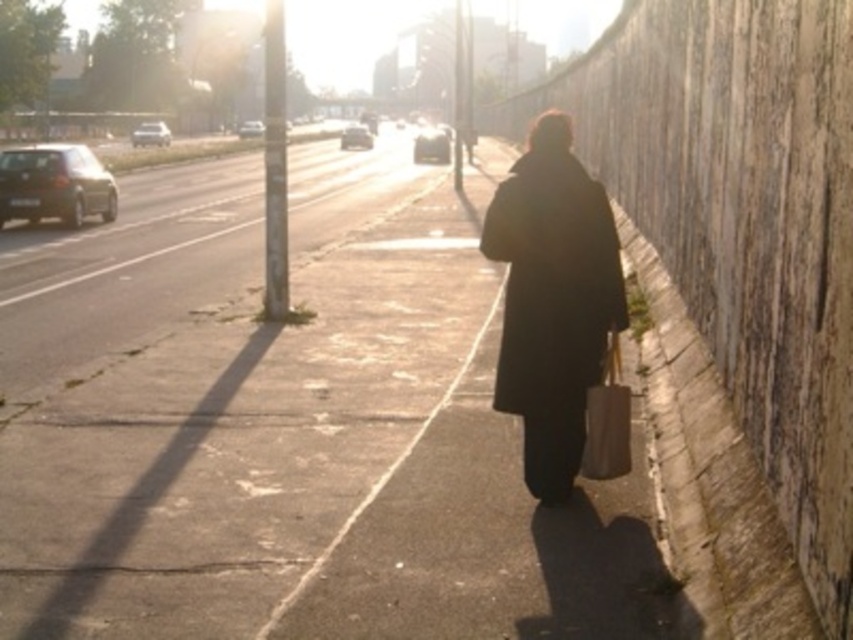
Find the location of a particular element. shiny black sedan at left is located at coordinates (54, 184).

Can you confirm if shiny black sedan at left is positioned below shiny silver sedan at left?

Correct, shiny black sedan at left is located below shiny silver sedan at left.

Where is `shiny black sedan at left`? This screenshot has width=853, height=640. shiny black sedan at left is located at coordinates (54, 184).

Locate an element on the screen. shiny black sedan at left is located at coordinates (54, 184).

Who is positioned more to the left, shiny silver sedan at center or metallic silver car at upper left?

metallic silver car at upper left is more to the left.

Between point (350, 140) and point (256, 124), which one is positioned in front?

Point (350, 140) is in front.

Where is `shiny silver sedan at center`? The height and width of the screenshot is (640, 853). shiny silver sedan at center is located at coordinates (357, 136).

Image resolution: width=853 pixels, height=640 pixels. What are the coordinates of `smooth concrete sidewalk at center` in the screenshot? It's located at (320, 472).

Locate an element on the screen. smooth concrete sidewalk at center is located at coordinates (320, 472).